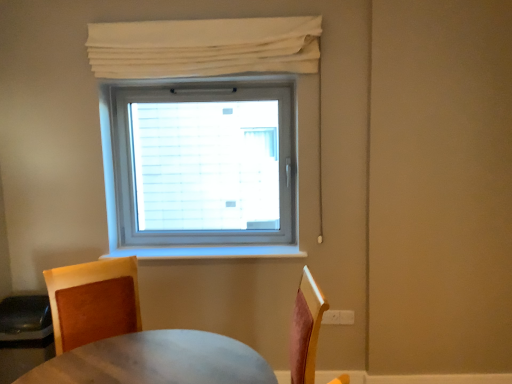
What is the approximate height of brown leather chair at lower left?

brown leather chair at lower left is 22.87 inches in height.

Identify the location of brown leather chair at lower left. The width and height of the screenshot is (512, 384). (93, 301).

This screenshot has width=512, height=384. Describe the element at coordinates (93, 301) in the screenshot. I see `brown leather chair at lower left` at that location.

You are a GUI agent. You are given a task and a screenshot of the screen. Output one action in this format:
    pyautogui.click(x=<x>, y=<y>)
    Task: Click on the white fabric curtain at upper center
    This screenshot has height=384, width=512.
    Given the screenshot: What is the action you would take?
    pyautogui.click(x=204, y=47)

Image resolution: width=512 pixels, height=384 pixels. What do you see at coordinates (204, 47) in the screenshot?
I see `white fabric curtain at upper center` at bounding box center [204, 47].

Locate an element on the screen. brown leather chair at lower left is located at coordinates (93, 301).

Which object is positioned more to the right, white fabric curtain at upper center or brown leather chair at lower left?

white fabric curtain at upper center.

Does white fabric curtain at upper center lie behind brown leather chair at lower left?

That is True.

Does point (276, 44) lie behind point (116, 295)?

Yes, point (276, 44) is behind point (116, 295).

From the image's perspective, is white fabric curtain at upper center over brown leather chair at lower left?

Yes, from the image's perspective, white fabric curtain at upper center is over brown leather chair at lower left.

From a real-world perspective, who is located lower, white fabric curtain at upper center or brown leather chair at lower left?

brown leather chair at lower left.

Is white fabric curtain at upper center wider or thinner than brown leather chair at lower left?

Considering their sizes, white fabric curtain at upper center looks slimmer than brown leather chair at lower left.

Considering the sizes of objects white fabric curtain at upper center and brown leather chair at lower left in the image provided, who is taller, white fabric curtain at upper center or brown leather chair at lower left?

brown leather chair at lower left is taller.

Can you confirm if white fabric curtain at upper center is bigger than brown leather chair at lower left?

Actually, white fabric curtain at upper center might be smaller than brown leather chair at lower left.

Is white fabric curtain at upper center completely or partially outside of brown leather chair at lower left?

That's correct, white fabric curtain at upper center is outside of brown leather chair at lower left.

Are white fabric curtain at upper center and brown leather chair at lower left far apart?

Yes, white fabric curtain at upper center is far from brown leather chair at lower left.

Is white fabric curtain at upper center facing towards brown leather chair at lower left?

No, white fabric curtain at upper center is not oriented towards brown leather chair at lower left.

This screenshot has height=384, width=512. What are the coordinates of `curtain on the right of the brown leather chair at lower left` in the screenshot? It's located at (204, 47).

Can you confirm if brown leather chair at lower left is positioned to the right of white fabric curtain at upper center?

In fact, brown leather chair at lower left is to the left of white fabric curtain at upper center.

Does brown leather chair at lower left come in front of white fabric curtain at upper center?

Yes.

Does point (136, 259) come behind point (106, 63)?

That is True.

From the image's perspective, which is below, brown leather chair at lower left or white fabric curtain at upper center?

brown leather chair at lower left, from the image's perspective.

From a real-world perspective, is brown leather chair at lower left on top of white fabric curtain at upper center?

No.

In the scene shown: Considering the sizes of brown leather chair at lower left and white fabric curtain at upper center in the image, is brown leather chair at lower left wider or thinner than white fabric curtain at upper center?

brown leather chair at lower left is wider than white fabric curtain at upper center.

Is brown leather chair at lower left taller than white fabric curtain at upper center?

Correct, brown leather chair at lower left is much taller as white fabric curtain at upper center.

Is brown leather chair at lower left bigger than white fabric curtain at upper center?

Correct, brown leather chair at lower left is larger in size than white fabric curtain at upper center.

Is brown leather chair at lower left situated inside white fabric curtain at upper center or outside?

The correct answer is: outside.

Is brown leather chair at lower left with white fabric curtain at upper center?

No, brown leather chair at lower left is not in contact with white fabric curtain at upper center.

Does brown leather chair at lower left turn towards white fabric curtain at upper center?

No.

What's the angular difference between brown leather chair at lower left and white fabric curtain at upper center's facing directions?

The facing directions of brown leather chair at lower left and white fabric curtain at upper center are 32.4 degrees apart.

How much distance is there between brown leather chair at lower left and white fabric curtain at upper center?

brown leather chair at lower left is 4.04 feet from white fabric curtain at upper center.

At what (x,y) coordinates should I click in order to perform the action: click on chair below the white fabric curtain at upper center (from a real-world perspective). Please return your answer as a coordinate pair (x, y). Looking at the image, I should click on (93, 301).

You are a GUI agent. You are given a task and a screenshot of the screen. Output one action in this format:
    pyautogui.click(x=<x>, y=<y>)
    Task: Click on the curtain above the brown leather chair at lower left (from the image's perspective)
    This screenshot has height=384, width=512.
    Given the screenshot: What is the action you would take?
    pyautogui.click(x=204, y=47)

Where is `curtain on the right of brown leather chair at lower left`? The width and height of the screenshot is (512, 384). curtain on the right of brown leather chair at lower left is located at coordinates (204, 47).